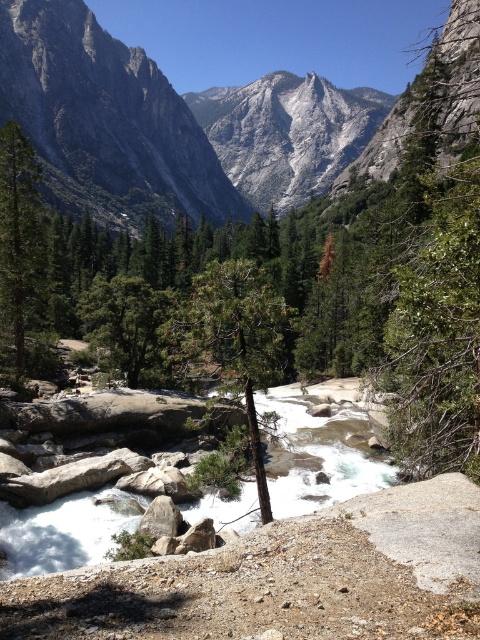
You are a hiker trying to determine which tree has a larger canopy spread. You see a green leafy tree at upper center and a green textured tree at center. Based on their positions, which tree likely has a wider canopy?

The green leafy tree at upper center might be wider than the green textured tree at center, so it likely has a wider canopy.

You are a hiker standing at the bottom of the valley looking up. You see the green leafy tree at upper center and the gray granite mountain at upper center. Which one is closer to you?

The green leafy tree at upper center is closer to you because it is positioned below the gray granite mountain at upper center, meaning it lies in a lower, nearer plane within the scene.

You are standing at the point marked by the coordinates point (435, 253) in the image. What do you see directly in front of you?

The point (435, 253) marks a green leafy tree at upper center, so directly in front of you is the green leafy tree at upper center.